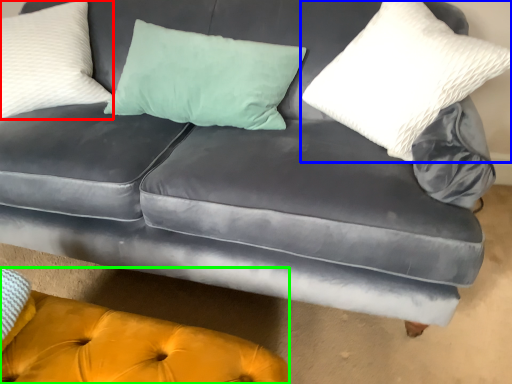
Question: Which object is positioned closest to pillow (highlighted by a red box)? Select from pillow (highlighted by a blue box) and couch (highlighted by a green box).

Choices:
 (A) pillow
 (B) couch

Answer: (B)